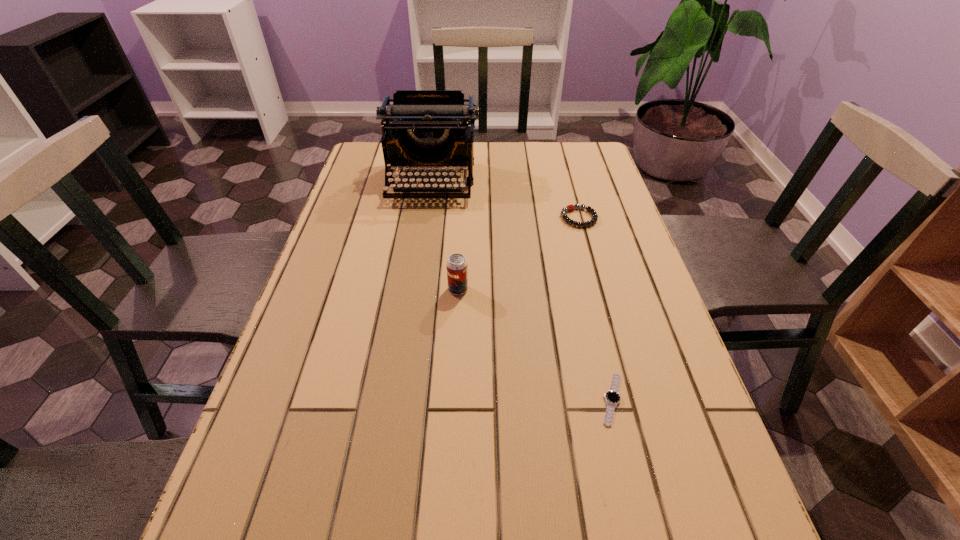
This screenshot has width=960, height=540. Find the location of `blank space located on the back of the second farthest object`. blank space located on the back of the second farthest object is located at coordinates (572, 195).

The image size is (960, 540). I want to click on blank space located on the left of the nearest object, so click(x=479, y=399).

Where is `object located at the far edge`? Image resolution: width=960 pixels, height=540 pixels. object located at the far edge is located at coordinates (422, 128).

You are a GUI agent. You are given a task and a screenshot of the screen. Output one action in this format:
    pyautogui.click(x=<x>, y=<y>)
    Task: Click on the object that is positioned at the left edge
    
    Given the screenshot: What is the action you would take?
    pyautogui.click(x=422, y=128)

You are a GUI agent. You are given a task and a screenshot of the screen. Output one action in this format:
    pyautogui.click(x=<x>, y=<y>)
    Task: Click on the bracelet that is positioned at the right edge
    
    Given the screenshot: What is the action you would take?
    pyautogui.click(x=570, y=207)

At what (x,y) coordinates should I click in order to perform the action: click on watch at the right edge. Please return your answer as a coordinate pair (x, y). The image size is (960, 540). Looking at the image, I should click on (612, 397).

Where is `object that is at the far left corner`? object that is at the far left corner is located at coordinates click(x=422, y=128).

Where is `free region at the left edge of the desktop`? This screenshot has width=960, height=540. free region at the left edge of the desktop is located at coordinates (278, 415).

The image size is (960, 540). I want to click on vacant space at the right edge of the desktop, so click(x=700, y=418).

I want to click on blank space at the far left corner of the desktop, so click(381, 145).